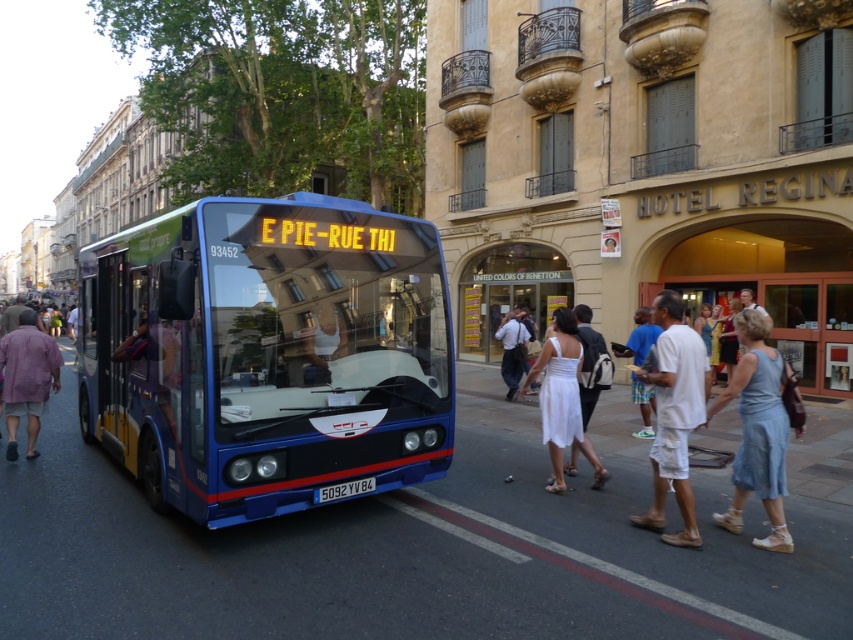
Question: Can you confirm if white cotton dress at center is positioned to the left of white cotton shorts at lower right?

Choices:
 (A) no
 (B) yes

Answer: (A)

Question: Can you confirm if white satin dress at center is positioned to the right of light purple cotton shirt at left?

Choices:
 (A) yes
 (B) no

Answer: (A)

Question: Considering the real-world distances, which object is closest to the denim dress at lower right?

Choices:
 (A) light purple cotton shirt at left
 (B) blue metallic bus at center
 (C) white cotton dress at center
 (D) white cotton shorts at lower right

Answer: (C)

Question: Considering the real-world distances, which object is closest to the white satin dress at center?

Choices:
 (A) white cotton dress at center
 (B) white cotton shorts at lower right

Answer: (B)

Question: Where is blue metallic bus at center located in relation to white cotton dress at center in the image?

Choices:
 (A) left
 (B) right

Answer: (A)

Question: Which object is positioned closest to the blue metallic bus at center?

Choices:
 (A) denim dress at lower right
 (B) white cotton shorts at lower right
 (C) light purple cotton shirt at left

Answer: (C)